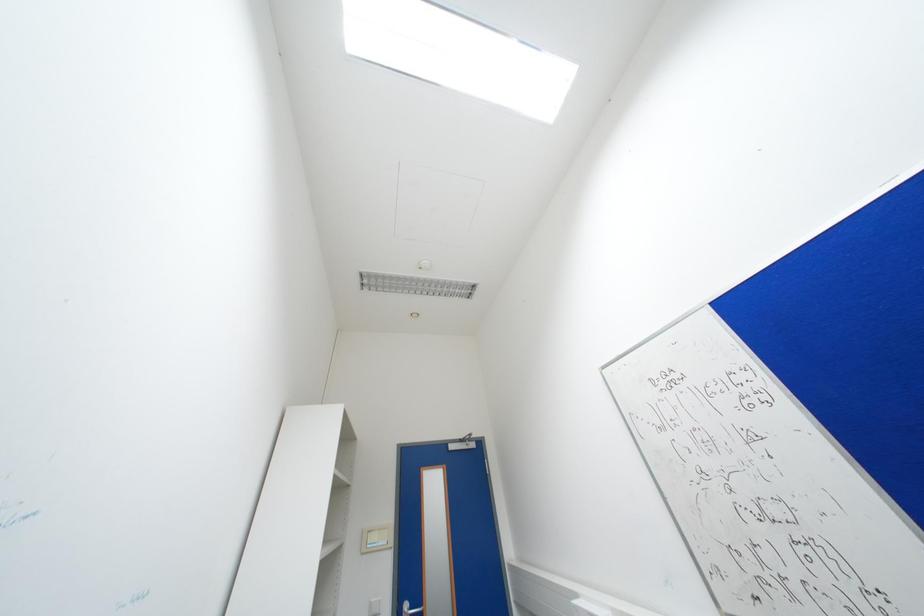
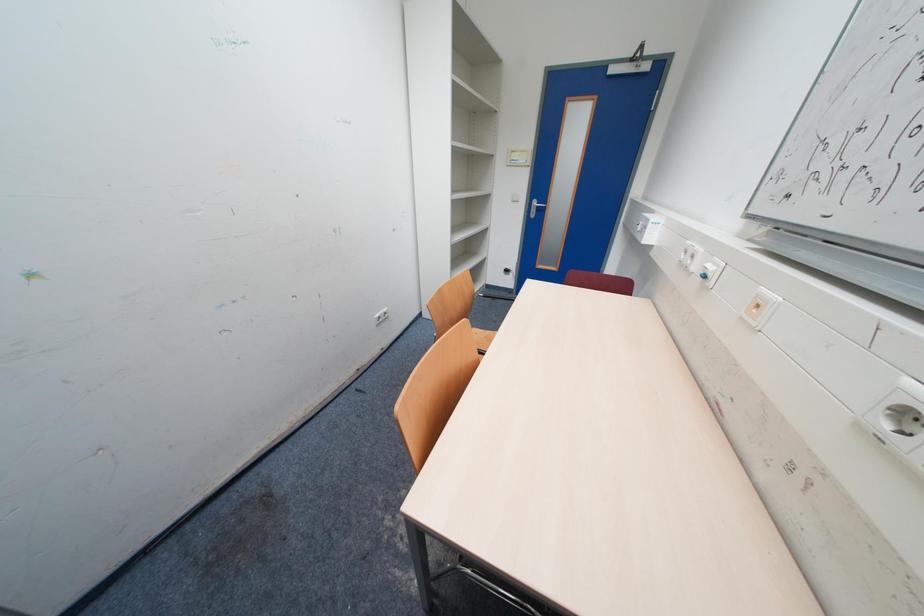
First-person continuous shooting, in which direction is the camera rotating?

The camera's rotation is toward left-down.